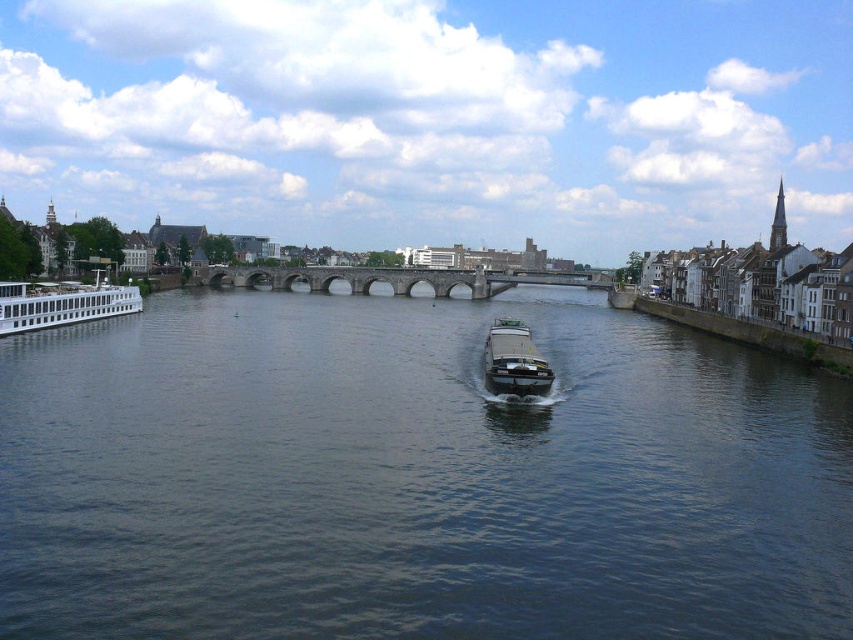
Question: Which point is farther to the camera?

Choices:
 (A) stone arch bridge at center
 (B) dark blue water at center

Answer: (A)

Question: Among these objects, which one is farthest from the camera?

Choices:
 (A) dark blue water at center
 (B) metallic gray barge at center
 (C) stone arch bridge at center
 (D) white glossy cruise ship at left

Answer: (C)

Question: Does white glossy cruise ship at left have a smaller size compared to metallic gray barge at center?

Choices:
 (A) yes
 (B) no

Answer: (B)

Question: Is dark blue water at center closer to camera compared to metallic gray barge at center?

Choices:
 (A) no
 (B) yes

Answer: (B)

Question: Is dark blue water at center in front of white glossy cruise ship at left?

Choices:
 (A) no
 (B) yes

Answer: (B)

Question: Which point is closer to the camera?

Choices:
 (A) dark blue water at center
 (B) stone arch bridge at center

Answer: (A)